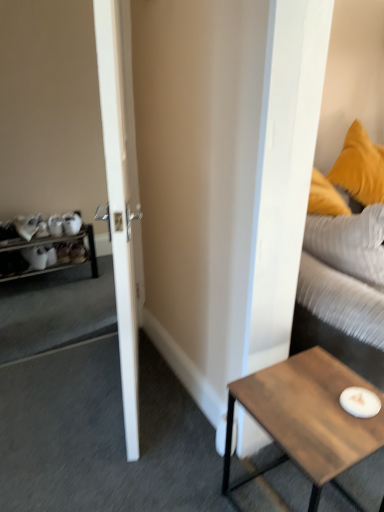
You are a GUI agent. You are given a task and a screenshot of the screen. Output one action in this format:
    pyautogui.click(x=<x>, y=<y>)
    Task: Click on the free space in front of wooden shelf at left
    The width and height of the screenshot is (384, 512).
    Given the screenshot: What is the action you would take?
    pyautogui.click(x=39, y=308)